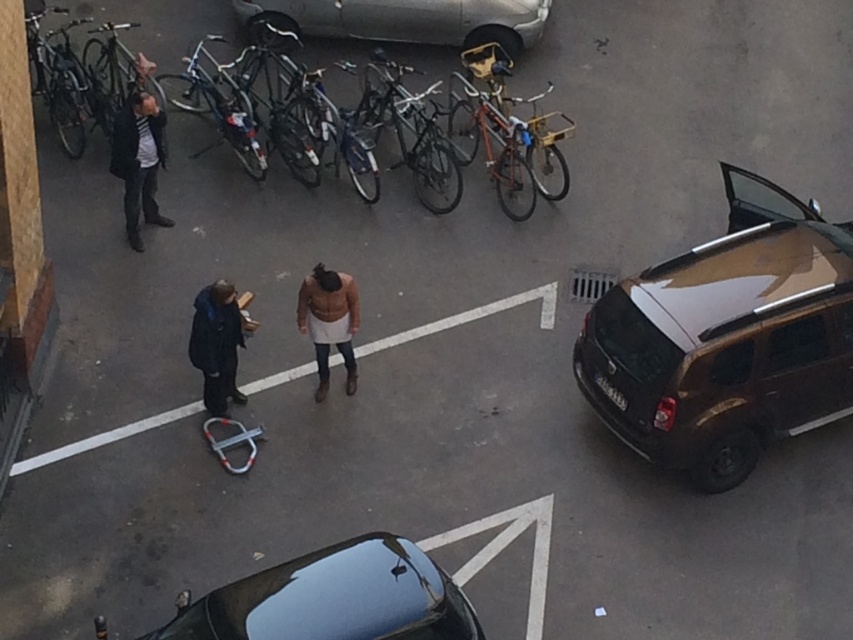
You are a delivery person needing to park your vehicle between the shiny brown suv at right and the silver metallic car at upper center. Based on their widths, which vehicle should you position your car closer to in order to fit properly?

Since the shiny brown suv at right has a lesser width compared to the silver metallic car at upper center, you should position your car closer to the shiny brown suv at right to ensure proper fitting between them.